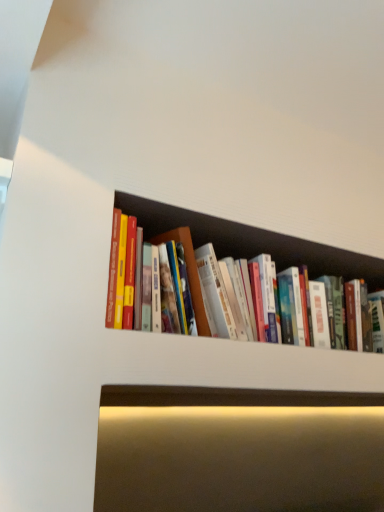
Image resolution: width=384 pixels, height=512 pixels. Find the location of `hardcover books at center`. hardcover books at center is located at coordinates (251, 241).

Measure the distance between point (149, 241) and camera.

Point (149, 241) is 37.24 inches from camera.

What do you see at coordinates (251, 241) in the screenshot? I see `hardcover books at center` at bounding box center [251, 241].

You are a GUI agent. You are given a task and a screenshot of the screen. Output one action in this format:
    pyautogui.click(x=<x>, y=<y>)
    Task: Click on the hardcover books at center
    This screenshot has height=512, width=384.
    Given the screenshot: What is the action you would take?
    pyautogui.click(x=251, y=241)